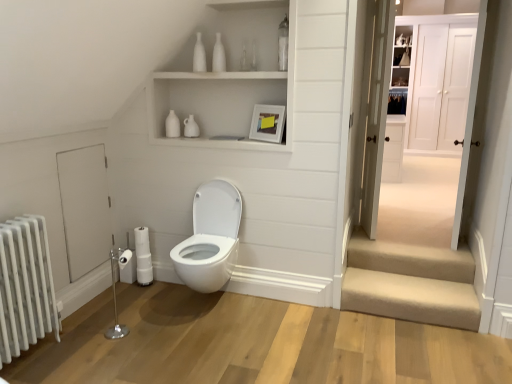
The width and height of the screenshot is (512, 384). I want to click on blank area beneath white marble radiator at left (from a real-world perspective), so [x=36, y=354].